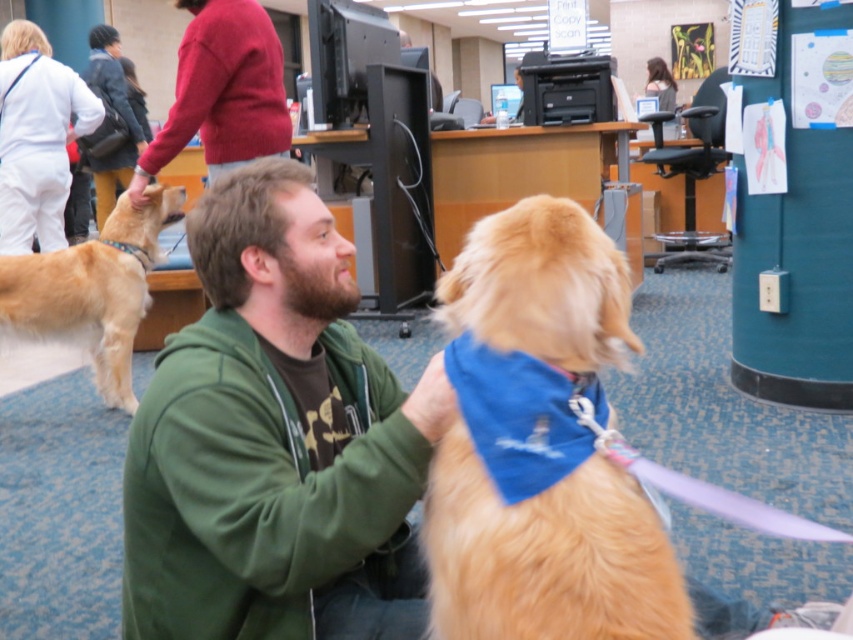
Does green fleece jacket at center have a greater width compared to golden fur dog at center?

Yes, green fleece jacket at center is wider than golden fur dog at center.

Does green fleece jacket at center have a smaller size compared to golden fur dog at center?

Actually, green fleece jacket at center might be larger than golden fur dog at center.

Is point (366, 346) closer to camera compared to point (460, 326)?

No, (366, 346) is behind (460, 326).

The width and height of the screenshot is (853, 640). What are the coordinates of `green fleece jacket at center` in the screenshot? It's located at (274, 444).

The height and width of the screenshot is (640, 853). What do you see at coordinates (547, 556) in the screenshot? I see `golden fur dog at center` at bounding box center [547, 556].

Does golden fur dog at center have a smaller size compared to blue fabric neckband at center?

Actually, golden fur dog at center might be larger than blue fabric neckband at center.

Where is `golden fur dog at center`? The width and height of the screenshot is (853, 640). golden fur dog at center is located at coordinates (547, 556).

Which is below, golden fur dog at center or golden fur dog at left?

Positioned lower is golden fur dog at center.

The image size is (853, 640). What do you see at coordinates (547, 556) in the screenshot?
I see `golden fur dog at center` at bounding box center [547, 556].

Locate an element on the screen. golden fur dog at center is located at coordinates (547, 556).